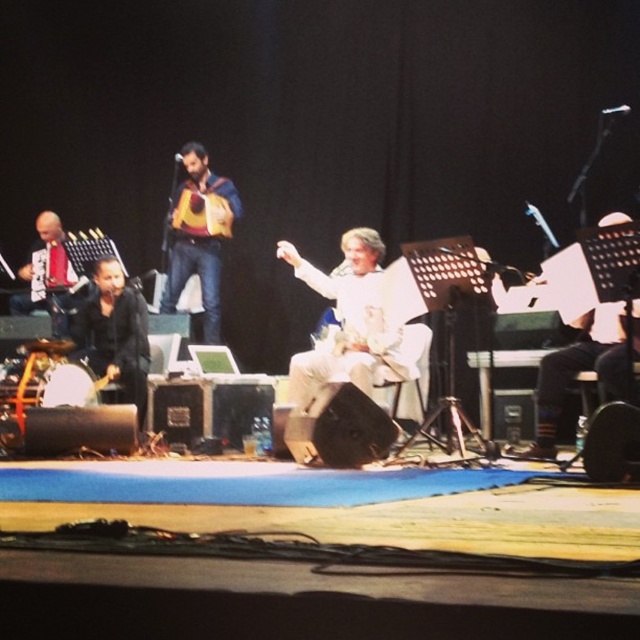
Between point (109, 257) and point (10, 312), which one is positioned behind?

The point (10, 312) is more distant.

Can you confirm if black leather jacket at lower left is thinner than matte black guitar at left?

Correct, black leather jacket at lower left's width is less than matte black guitar at left's.

Is point (109, 310) closer to camera compared to point (56, 300)?

Yes, point (109, 310) is in front of point (56, 300).

Locate an element on the screen. black leather jacket at lower left is located at coordinates (115, 333).

Does white paper at right appear on the right side of black leather jacket at lower left?

Correct, you'll find white paper at right to the right of black leather jacket at lower left.

Which is more to the right, white paper at right or black leather jacket at lower left?

white paper at right

Is point (621, 344) closer to camera compared to point (109, 340)?

Yes, point (621, 344) is in front of point (109, 340).

You are a GUI agent. You are given a task and a screenshot of the screen. Output one action in this format:
    pyautogui.click(x=<x>, y=<y>)
    Task: Click on the white paper at right
    This screenshot has width=640, height=640.
    Given the screenshot: What is the action you would take?
    pyautogui.click(x=586, y=369)

What do you see at coordinates (353, 323) in the screenshot?
I see `white fabric at center` at bounding box center [353, 323].

From the picture: Does white fabric at center appear under brown leather guitar at center?

Correct, white fabric at center is located below brown leather guitar at center.

Between point (342, 275) and point (189, 141), which one is positioned behind?

The point (189, 141) is more distant.

Locate an element on the screen. white fabric at center is located at coordinates (x=353, y=323).